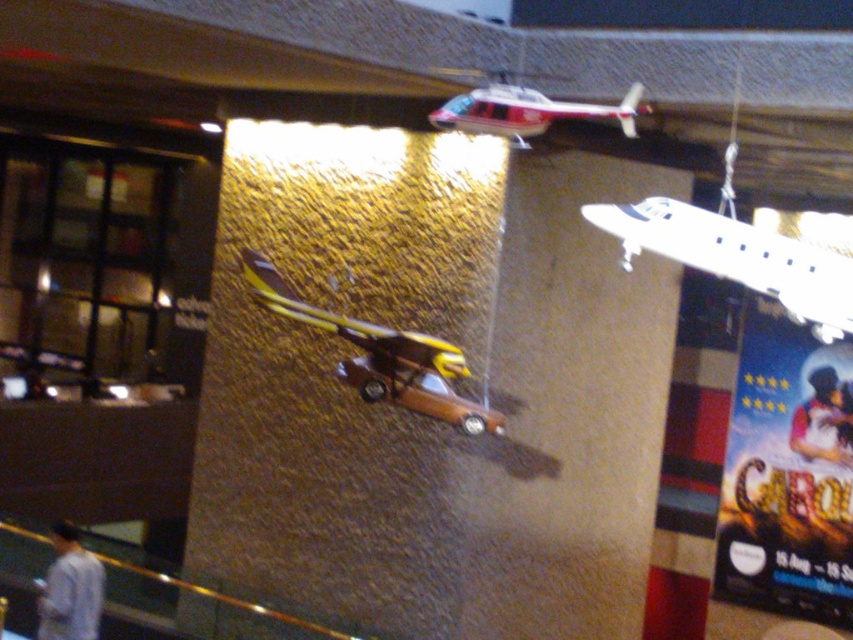
Question: Can you confirm if blue glossy poster at upper right is thinner than red and white plastic helicopter at upper center?

Choices:
 (A) yes
 (B) no

Answer: (A)

Question: Considering the relative positions of blue glossy poster at upper right and yellow matte airplane at center in the image provided, where is blue glossy poster at upper right located with respect to yellow matte airplane at center?

Choices:
 (A) below
 (B) above

Answer: (A)

Question: Which point appears closest to the camera in this image?

Choices:
 (A) (363, 348)
 (B) (602, 116)
 (C) (759, 264)
 (D) (756, 531)

Answer: (C)

Question: Can you confirm if blue glossy poster at upper right is positioned to the left of white matte airplane at upper right?

Choices:
 (A) no
 (B) yes

Answer: (A)

Question: Which of the following is the closest to the observer?

Choices:
 (A) blue glossy poster at upper right
 (B) yellow matte airplane at center
 (C) white matte airplane at upper right
 (D) red and white plastic helicopter at upper center

Answer: (C)

Question: Which of the following is the farthest from the observer?

Choices:
 (A) white matte airplane at upper right
 (B) red and white plastic helicopter at upper center
 (C) blue glossy poster at upper right
 (D) yellow matte airplane at center

Answer: (C)